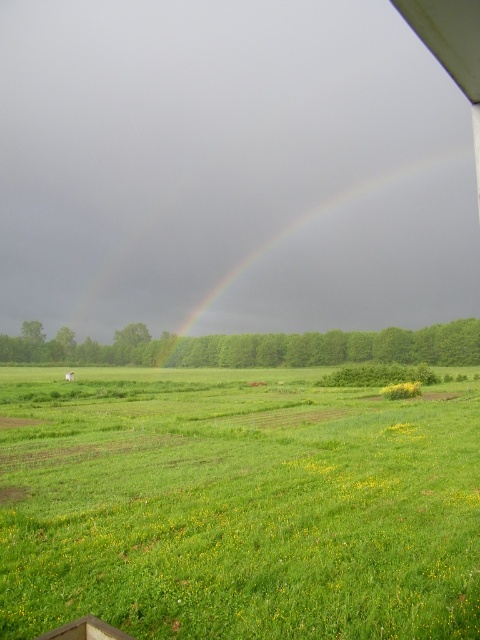
You are standing at the point marked by the coordinates point (238, 506) in the image. What is the immediate terrain beneath your feet?

The point (238, 506) marks green grassy field at lower center, so the immediate terrain beneath your feet is green grassy field at lower center.

Looking at this image, you are standing at the center of the image and want to walk towards the green grassy field at lower center. Which direction should you face?

Since the green grassy field at lower center is located at coordinates approximately 0.791 on the x axis and 0.496 on the y axis, you should face towards the lower center direction to walk towards it.